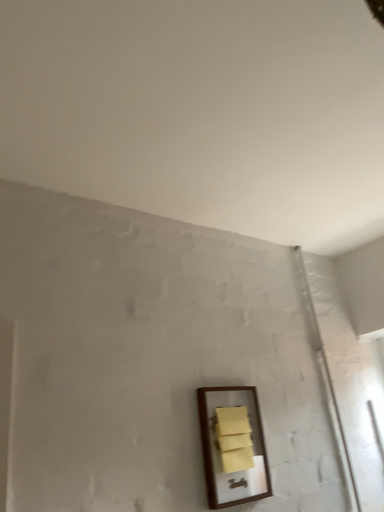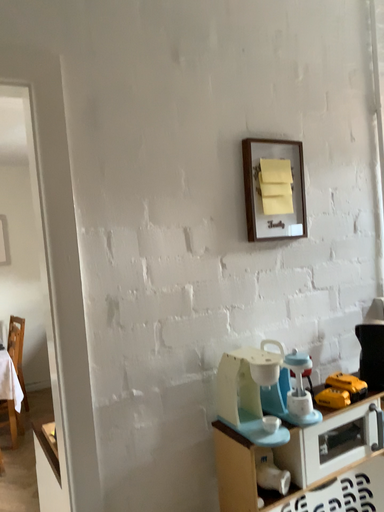
Question: Which way did the camera rotate in the video?

Choices:
 (A) rotated upward
 (B) rotated downward

Answer: (B)